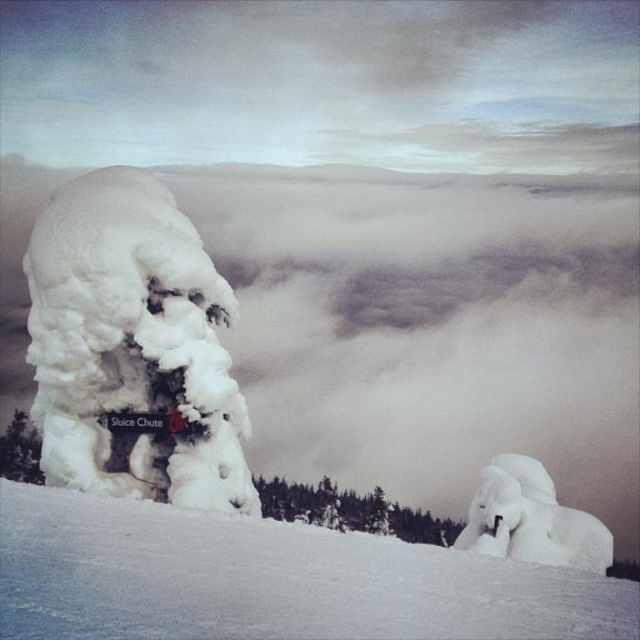
Question: Can you confirm if white snow at lower center is positioned to the right of white fluffy snow at left?

Choices:
 (A) no
 (B) yes

Answer: (B)

Question: Does white snow at lower center have a larger size compared to white fluffy snow at left?

Choices:
 (A) no
 (B) yes

Answer: (A)

Question: Which object is closer to the camera taking this photo?

Choices:
 (A) white fluffy snow at left
 (B) white snow at lower center

Answer: (B)

Question: Does white snow at lower center have a larger size compared to white fluffy snow at left?

Choices:
 (A) no
 (B) yes

Answer: (A)

Question: Which of the following is the farthest from the observer?

Choices:
 (A) (68, 376)
 (B) (312, 580)

Answer: (A)